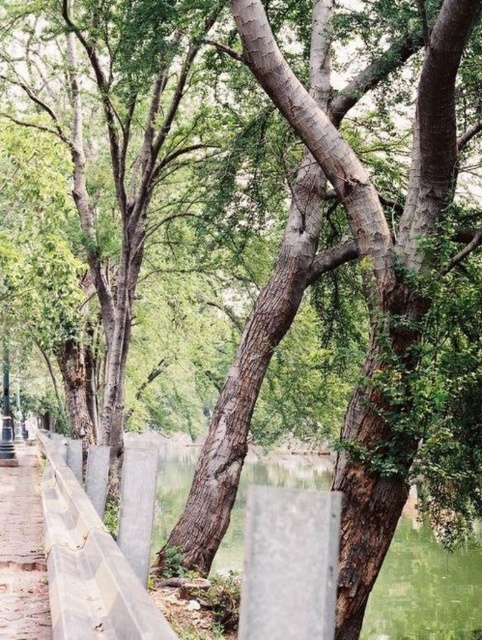
You are standing on the brown stone pavement at lower left and want to see the green water at center. Which direction should you look to see it?

The green water at center is below the brown stone pavement at lower left, so you should look downward to see it.

You are a hiker standing on the brown stone pavement at lower left and want to cross to the green water at center. Do you need to climb upwards or downwards to reach it?

The green water at center has a greater height compared to the brown stone pavement at lower left, so you need to climb upwards to reach it.